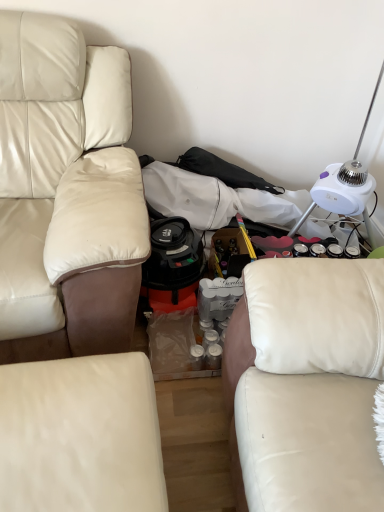
The width and height of the screenshot is (384, 512). In order to click on beige leather couch at left, acting as the first studio couch starting from the left in this screenshot , I will do `click(66, 194)`.

What do you see at coordinates (345, 184) in the screenshot?
I see `white plastic table lamp at upper right` at bounding box center [345, 184].

What do you see at coordinates (81, 436) in the screenshot? This screenshot has width=384, height=512. I see `white leather studio couch at lower center, arranged as the 2th studio couch when viewed from the left` at bounding box center [81, 436].

Identify the location of white leather studio couch at lower center, arranged as the 2th studio couch when viewed from the left. (81, 436).

At what (x,y) coordinates should I click in order to perform the action: click on white leather studio couch at right, the first studio couch when ordered from right to left. Please return your answer as a coordinate pair (x, y). Looking at the image, I should click on (308, 383).

Where is `beige leather couch at left, acting as the first studio couch starting from the left`? This screenshot has height=512, width=384. beige leather couch at left, acting as the first studio couch starting from the left is located at coordinates (66, 194).

Could you measure the distance between white plastic table lamp at upper right and white leather studio couch at lower center, arranged as the 2th studio couch when viewed from the left?

white plastic table lamp at upper right and white leather studio couch at lower center, arranged as the 2th studio couch when viewed from the left, are 3.97 feet apart from each other.

Would you say white plastic table lamp at upper right is a long distance from white leather studio couch at lower center, which appears as the second studio couch when viewed from the right?

That's right, there is a large distance between white plastic table lamp at upper right and white leather studio couch at lower center, which appears as the second studio couch when viewed from the right.

Is white plastic table lamp at upper right aimed at white leather studio couch at lower center, which appears as the second studio couch when viewed from the right?

No, white plastic table lamp at upper right does not turn towards white leather studio couch at lower center, which appears as the second studio couch when viewed from the right.

Is the depth of white plastic table lamp at upper right greater than that of white leather studio couch at lower center, arranged as the 2th studio couch when viewed from the left?

Yes, the depth of white plastic table lamp at upper right is greater than that of white leather studio couch at lower center, arranged as the 2th studio couch when viewed from the left.

Between white leather studio couch at lower center, arranged as the 2th studio couch when viewed from the left, and beige leather couch at left, acting as the first studio couch starting from the left, which one has smaller width?

white leather studio couch at lower center, arranged as the 2th studio couch when viewed from the left.

Can you confirm if white leather studio couch at lower center, arranged as the 2th studio couch when viewed from the left, is positioned to the right of beige leather couch at left, which appears as the 3th studio couch when viewed from the right?

Indeed, white leather studio couch at lower center, arranged as the 2th studio couch when viewed from the left, is positioned on the right side of beige leather couch at left, which appears as the 3th studio couch when viewed from the right.

How different are the orientations of white leather studio couch at lower center, arranged as the 2th studio couch when viewed from the left, and beige leather couch at left, acting as the first studio couch starting from the left, in degrees?

There is a 2.73-degree angle between the facing directions of white leather studio couch at lower center, arranged as the 2th studio couch when viewed from the left, and beige leather couch at left, acting as the first studio couch starting from the left.

Is white leather studio couch at lower center, which appears as the second studio couch when viewed from the right, positioned before beige leather couch at left, acting as the first studio couch starting from the left?

That is True.

Do you think beige leather couch at left, acting as the first studio couch starting from the left, is within white plastic table lamp at upper right, or outside of it?

beige leather couch at left, acting as the first studio couch starting from the left, is not inside white plastic table lamp at upper right, it's outside.

Is beige leather couch at left, acting as the first studio couch starting from the left, closer to camera compared to white plastic table lamp at upper right?

Yes, it is in front of white plastic table lamp at upper right.

Considering the sizes of beige leather couch at left, acting as the first studio couch starting from the left, and white plastic table lamp at upper right in the image, is beige leather couch at left, acting as the first studio couch starting from the left, taller or shorter than white plastic table lamp at upper right?

Considering their sizes, beige leather couch at left, acting as the first studio couch starting from the left, has more height than white plastic table lamp at upper right.

From a real-world perspective, is beige leather couch at left, which appears as the 3th studio couch when viewed from the right, positioned above or below white plastic table lamp at upper right?

beige leather couch at left, which appears as the 3th studio couch when viewed from the right, is below white plastic table lamp at upper right.

From a real-world perspective, which object stands above the other?

In real-world perspective, white plastic table lamp at upper right is above.

In the scene shown: Is white plastic table lamp at upper right oriented away from beige leather couch at left, which appears as the 3th studio couch when viewed from the right?

white plastic table lamp at upper right does not have its back to beige leather couch at left, which appears as the 3th studio couch when viewed from the right.

Would you say white plastic table lamp at upper right is outside beige leather couch at left, acting as the first studio couch starting from the left?

Absolutely, white plastic table lamp at upper right is external to beige leather couch at left, acting as the first studio couch starting from the left.

Which of these two, white leather studio couch at right, placed as the third studio couch when sorted from left to right, or white leather studio couch at lower center, arranged as the 2th studio couch when viewed from the left, is wider?

With larger width is white leather studio couch at right, placed as the third studio couch when sorted from left to right.

From the image's perspective, between white leather studio couch at right, placed as the third studio couch when sorted from left to right, and white leather studio couch at lower center, arranged as the 2th studio couch when viewed from the left, which one is located above?

white leather studio couch at right, placed as the third studio couch when sorted from left to right, is shown above in the image.

Does white leather studio couch at right, the first studio couch when ordered from right to left, turn towards white leather studio couch at lower center, which appears as the second studio couch when viewed from the right?

Yes, white leather studio couch at right, the first studio couch when ordered from right to left, faces towards white leather studio couch at lower center, which appears as the second studio couch when viewed from the right.

From a real-world perspective, between white leather studio couch at lower center, which appears as the second studio couch when viewed from the right, and white leather studio couch at right, the first studio couch when ordered from right to left, who is vertically higher?

In real-world perspective, white leather studio couch at right, the first studio couch when ordered from right to left, is above.

Considering the points (81, 479) and (377, 266), which point is behind, point (81, 479) or point (377, 266)?

Point (377, 266)

Based on their positions, is white leather studio couch at lower center, which appears as the second studio couch when viewed from the right, located to the left or right of white leather studio couch at right, the first studio couch when ordered from right to left?

Based on their positions, white leather studio couch at lower center, which appears as the second studio couch when viewed from the right, is located to the left of white leather studio couch at right, the first studio couch when ordered from right to left.

Is white leather studio couch at lower center, which appears as the second studio couch when viewed from the right, wider than white plastic table lamp at upper right?

Yes.

Could you tell me if white leather studio couch at lower center, arranged as the 2th studio couch when viewed from the left, is turned towards white plastic table lamp at upper right?

No.

Between white leather studio couch at lower center, arranged as the 2th studio couch when viewed from the left, and white plastic table lamp at upper right, which one is positioned in front?

Positioned in front is white leather studio couch at lower center, arranged as the 2th studio couch when viewed from the left.

What are the coordinates of `studio couch that is the 3rd one when counting downward from the white plastic table lamp at upper right (from the image's perspective)` in the screenshot? It's located at tap(81, 436).

At what (x,y) coordinates should I click in order to perform the action: click on table lamp lying on the right of white leather studio couch at lower center, arranged as the 2th studio couch when viewed from the left. Please return your answer as a coordinate pair (x, y). The width and height of the screenshot is (384, 512). Looking at the image, I should click on (345, 184).

Find the location of `the 1st studio couch in front of the beige leather couch at left, which appears as the 3th studio couch when viewed from the right, counting from the anchor's position`. the 1st studio couch in front of the beige leather couch at left, which appears as the 3th studio couch when viewed from the right, counting from the anchor's position is located at coordinates (81, 436).

Considering their positions, is white plastic table lamp at upper right positioned closer to white leather studio couch at lower center, arranged as the 2th studio couch when viewed from the left, than white leather studio couch at right, the first studio couch when ordered from right to left?

white leather studio couch at right, the first studio couch when ordered from right to left, is positioned closer to the anchor white leather studio couch at lower center, arranged as the 2th studio couch when viewed from the left.

Considering their positions, is beige leather couch at left, which appears as the 3th studio couch when viewed from the right, positioned closer to white leather studio couch at lower center, which appears as the second studio couch when viewed from the right, than white plastic table lamp at upper right?

The object closer to white leather studio couch at lower center, which appears as the second studio couch when viewed from the right, is beige leather couch at left, which appears as the 3th studio couch when viewed from the right.

Looking at this image, considering their positions, is white plastic table lamp at upper right positioned further to beige leather couch at left, which appears as the 3th studio couch when viewed from the right, than white leather studio couch at right, placed as the third studio couch when sorted from left to right?

white plastic table lamp at upper right is positioned further to the anchor beige leather couch at left, which appears as the 3th studio couch when viewed from the right.

When comparing their distances from white plastic table lamp at upper right, does white leather studio couch at lower center, arranged as the 2th studio couch when viewed from the left, or white leather studio couch at right, placed as the third studio couch when sorted from left to right, seem further?

The object further to white plastic table lamp at upper right is white leather studio couch at lower center, arranged as the 2th studio couch when viewed from the left.

From the image, which object appears to be farther from beige leather couch at left, acting as the first studio couch starting from the left, white leather studio couch at lower center, which appears as the second studio couch when viewed from the right, or white plastic table lamp at upper right?

white plastic table lamp at upper right.

Looking at this image, looking at the image, which one is located closer to white leather studio couch at right, placed as the third studio couch when sorted from left to right, beige leather couch at left, which appears as the 3th studio couch when viewed from the right, or white plastic table lamp at upper right?

beige leather couch at left, which appears as the 3th studio couch when viewed from the right, lies closer to white leather studio couch at right, placed as the third studio couch when sorted from left to right, than the other object.

When comparing their distances from white leather studio couch at right, the first studio couch when ordered from right to left, does beige leather couch at left, acting as the first studio couch starting from the left, or white leather studio couch at lower center, which appears as the second studio couch when viewed from the right, seem further?

beige leather couch at left, acting as the first studio couch starting from the left.

Considering their positions, is white leather studio couch at lower center, arranged as the 2th studio couch when viewed from the left, positioned closer to white leather studio couch at right, placed as the third studio couch when sorted from left to right, than beige leather couch at left, acting as the first studio couch starting from the left?

The object closer to white leather studio couch at right, placed as the third studio couch when sorted from left to right, is white leather studio couch at lower center, arranged as the 2th studio couch when viewed from the left.

Where is `studio couch between beige leather couch at left, acting as the first studio couch starting from the left, and white leather studio couch at right, the first studio couch when ordered from right to left`? The height and width of the screenshot is (512, 384). studio couch between beige leather couch at left, acting as the first studio couch starting from the left, and white leather studio couch at right, the first studio couch when ordered from right to left is located at coordinates (81, 436).